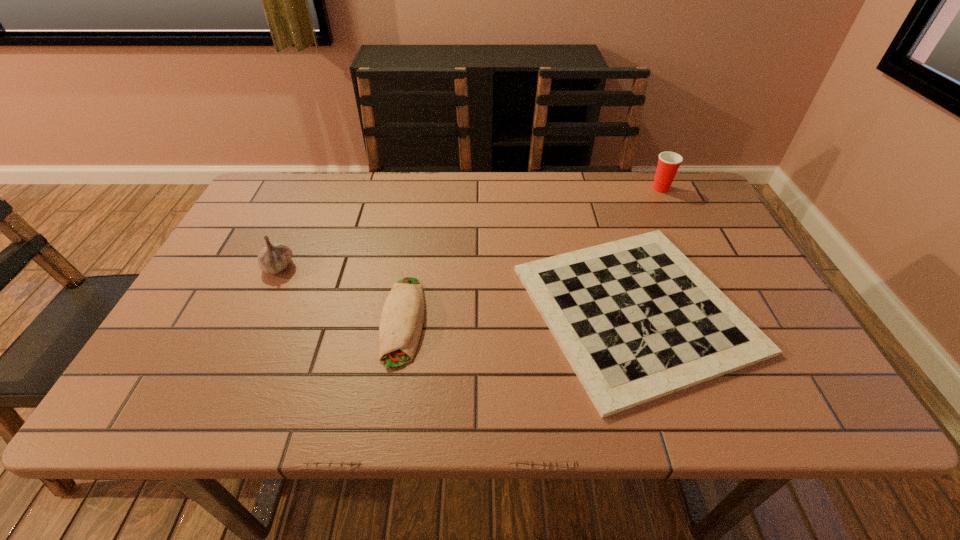
Identify which object is the third nearest to the checkerboard. Please provide its 2D coordinates. Your answer should be formatted as a tuple, i.e. [(x, y)], where the tuple contains the x and y coordinates of a point satisfying the conditions above.

[(273, 258)]

Where is `object that can be found as the closest to the burrito`? This screenshot has height=540, width=960. object that can be found as the closest to the burrito is located at coordinates (636, 319).